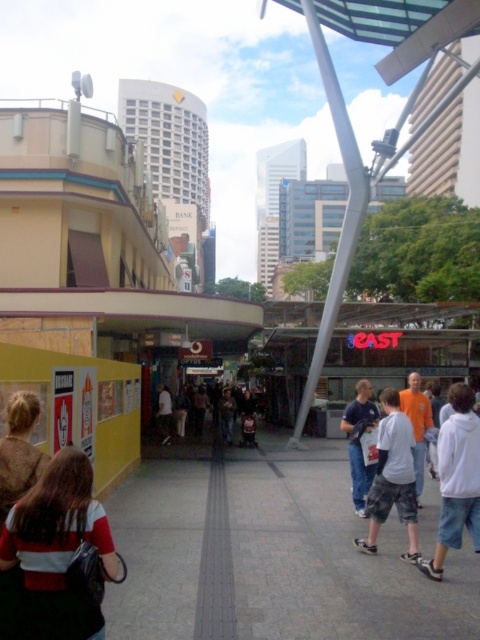
Question: Does gray concrete pavement at center have a larger size compared to dark brown leather jacket at center?

Choices:
 (A) yes
 (B) no

Answer: (A)

Question: Which point appears closest to the camera in this image?

Choices:
 (A) (361, 403)
 (B) (225, 387)
 (C) (468, 499)

Answer: (C)

Question: Is camouflage shorts at center thinner than brown textured sweater at lower left?

Choices:
 (A) no
 (B) yes

Answer: (A)

Question: Does striped fabric shirt at lower left lie behind denim shorts at center?

Choices:
 (A) no
 (B) yes

Answer: (A)

Question: Which of the following is the closest to the observer?

Choices:
 (A) (34, 394)
 (B) (254, 452)
 (C) (427, 410)
 (D) (86, 627)

Answer: (D)

Question: Among these points, which one is nearest to the camera?

Choices:
 (A) (160, 416)
 (B) (374, 532)
 (C) (69, 577)

Answer: (C)